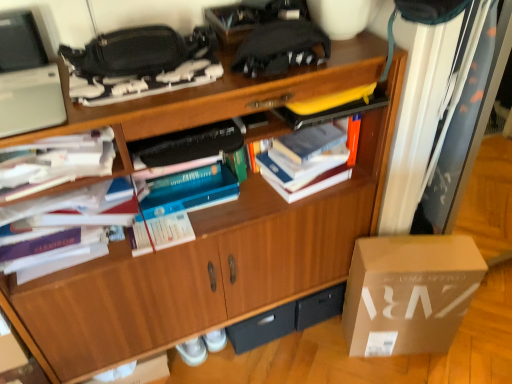
Question: From a real-world perspective, is silver matte laptop at upper left above or below black fabric handbag at upper center?

Choices:
 (A) below
 (B) above

Answer: (A)

Question: Considering the positions of point (41, 117) and point (161, 31), is point (41, 117) closer or farther from the camera than point (161, 31)?

Choices:
 (A) closer
 (B) farther

Answer: (A)

Question: Considering the real-world distances, which object is closest to the white cardboard box at lower right?

Choices:
 (A) black plastic drawer at lower center
 (B) white paper at upper left, marked as the second book in a right-to-left arrangement
 (C) white paper at left, which is the 1th book from left to right
 (D) wooden cabinet at center
 (E) silver matte laptop at upper left

Answer: (D)

Question: Which is nearer to the black fabric handbag at upper center?

Choices:
 (A) silver matte laptop at upper left
 (B) white cardboard box at lower right
 (C) wooden cabinet at center
 (D) black plastic drawer at lower center
 (E) white paper at left, which is the 1th book from left to right

Answer: (A)